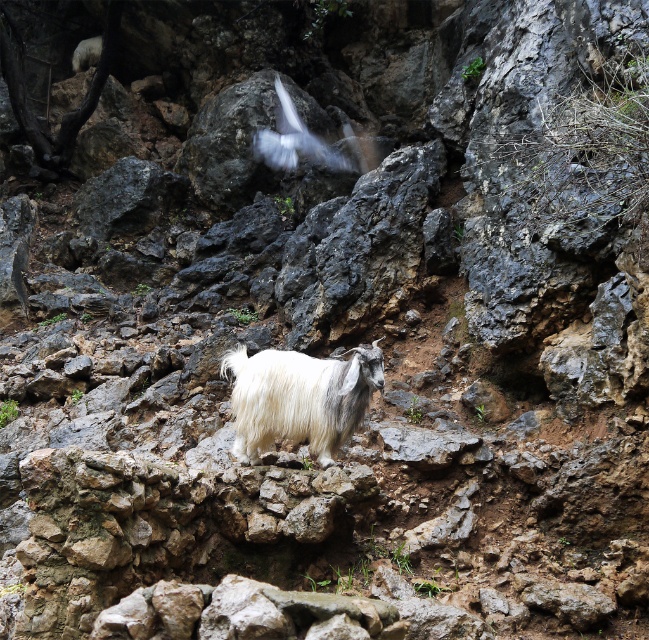
Question: Is white woolen goat at center below white fluffy bird at upper center?

Choices:
 (A) no
 (B) yes

Answer: (B)

Question: Which of the following is the closest to the observer?

Choices:
 (A) white woolen goat at center
 (B) white fluffy bird at upper center

Answer: (A)

Question: Is white woolen goat at center smaller than white fluffy bird at upper center?

Choices:
 (A) yes
 (B) no

Answer: (A)

Question: Can you confirm if white woolen goat at center is smaller than white fluffy bird at upper center?

Choices:
 (A) no
 (B) yes

Answer: (B)